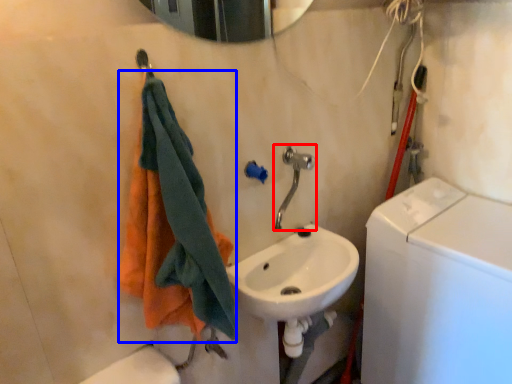
Question: Among these objects, which one is farthest to the camera, plumbing fixture (highlighted by a red box) or towel (highlighted by a blue box)?

Choices:
 (A) plumbing fixture
 (B) towel

Answer: (A)